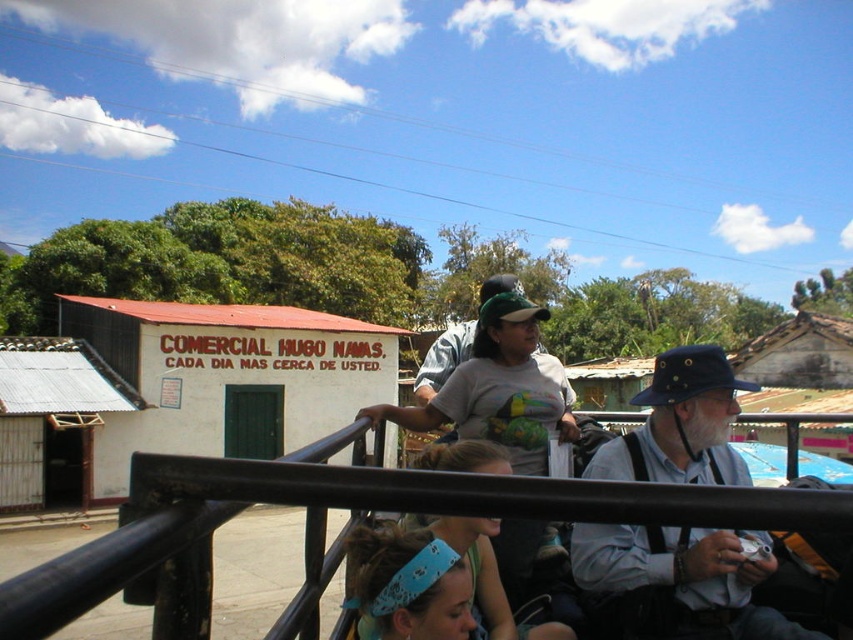
Question: Which point is closer to the camera taking this photo?

Choices:
 (A) click(x=463, y=337)
 (B) click(x=538, y=538)
 (C) click(x=689, y=500)

Answer: (C)

Question: Is black metal/rail at center below gray cotton t-shirt at center?

Choices:
 (A) no
 (B) yes

Answer: (B)

Question: Can you confirm if gray fabric hat at upper right is positioned below gray cotton t-shirt at center?

Choices:
 (A) no
 (B) yes

Answer: (B)

Question: Is gray fabric hat at upper right to the right of gray cotton t-shirt at center from the viewer's perspective?

Choices:
 (A) yes
 (B) no

Answer: (A)

Question: Which point appears closest to the camera in this image?

Choices:
 (A) (381, 410)
 (B) (689, 410)
 (C) (511, 275)

Answer: (B)

Question: Which point appears closest to the camera in this image?

Choices:
 (A) (663, 550)
 (B) (479, 376)

Answer: (A)